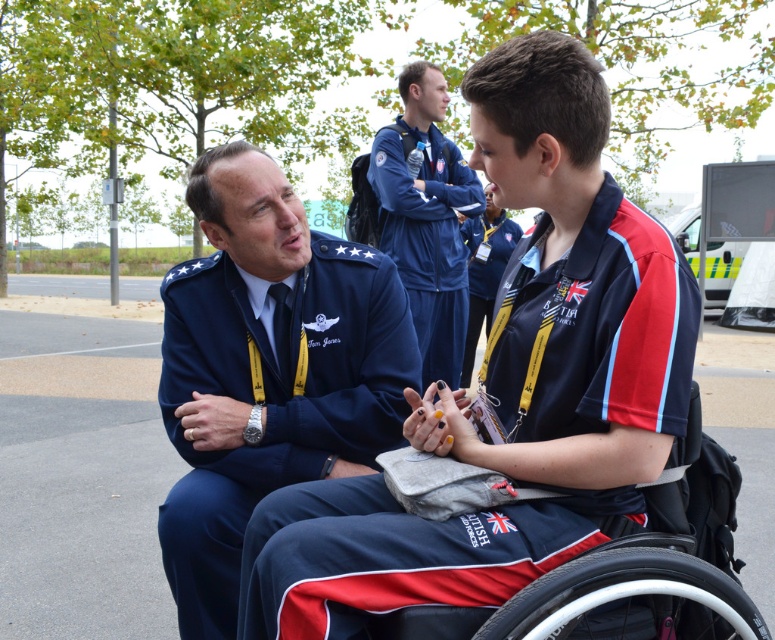
Question: Which point is farther to the camera?

Choices:
 (A) (294, 285)
 (B) (403, 186)
 (C) (488, 227)
 (D) (600, 588)

Answer: (C)

Question: Estimate the real-world distances between objects in this image. Which object is closer to the blue fabric tracksuit at upper center?

Choices:
 (A) blue fabric shirt at center
 (B) navy blue fabric uniform at center
 (C) blue fabric jacket at center

Answer: (C)

Question: Does blue fabric shirt at center appear on the left side of blue fabric jacket at center?

Choices:
 (A) yes
 (B) no

Answer: (A)

Question: Estimate the real-world distances between objects in this image. Which object is farther from the blue fabric jacket at center?

Choices:
 (A) black plastic wheelchair at lower center
 (B) navy blue fabric uniform at center
 (C) blue fabric tracksuit at upper center
 (D) blue fabric shirt at center

Answer: (A)

Question: Is blue fabric tracksuit at upper center to the right of black plastic wheelchair at lower center from the viewer's perspective?

Choices:
 (A) no
 (B) yes

Answer: (A)

Question: Can you confirm if blue fabric shirt at center is positioned to the right of blue fabric tracksuit at upper center?

Choices:
 (A) no
 (B) yes

Answer: (B)